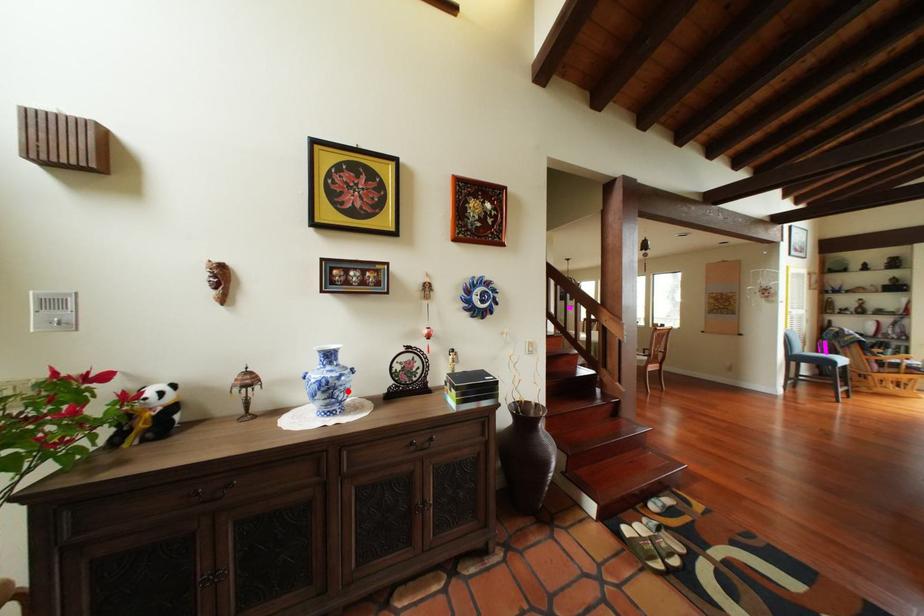
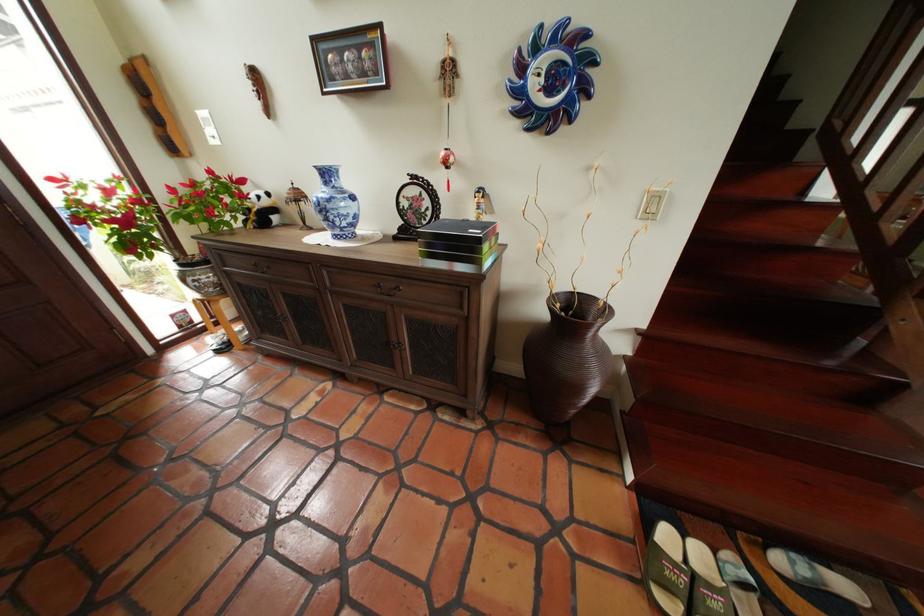
Question: I am providing you with two images of the same scene from different viewpoints. Image1 has a red point marked. In image2, the corresponding 3D location appears at what relative position? Reply with the corresponding letter.

Choices:
 (A) Closer
 (B) Farther

Answer: (A)